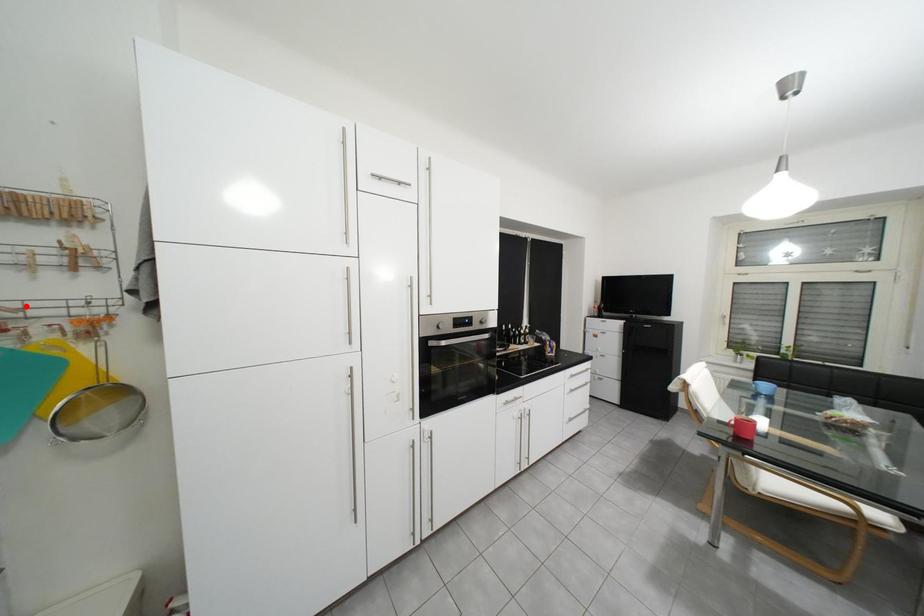
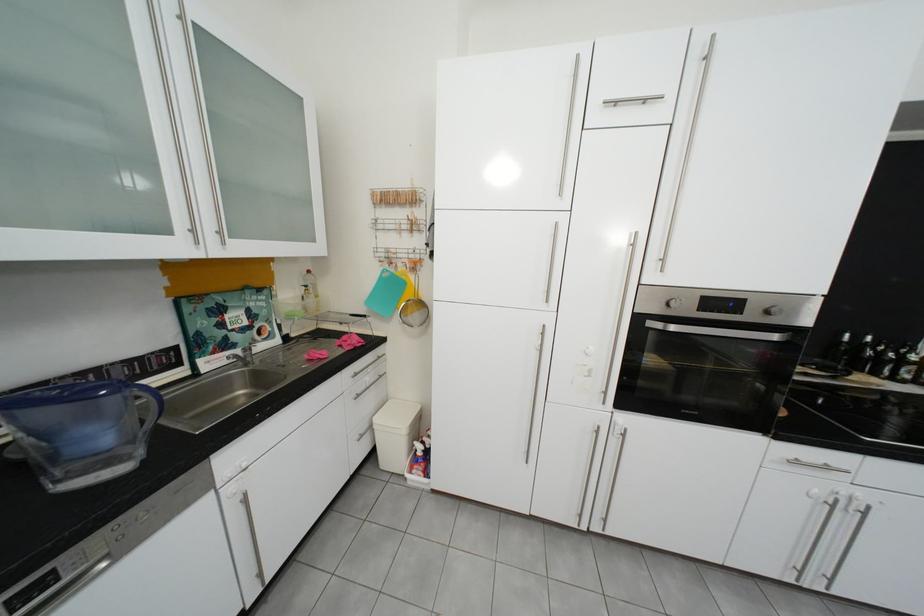
The point at the highlighted location is marked in the first image. Where is the corresponding point in the second image?

(406, 252)